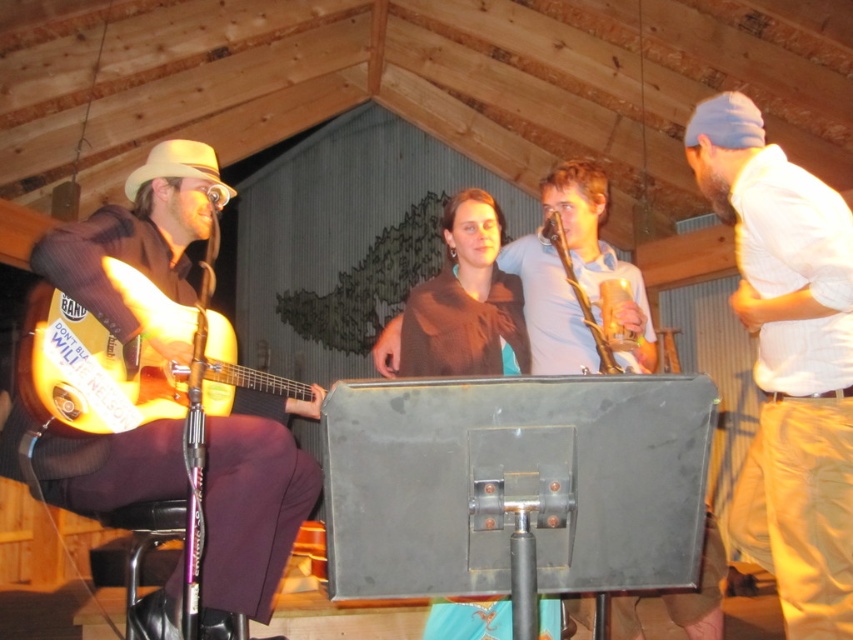
From the picture: You are a photographer at the event and need to capture a photo that includes both the white cotton shirt at right and the shiny orange electric guitar at left. Based on their positions, which object should be placed on the right side of the photo frame?

The white cotton shirt at right should be placed on the right side of the photo frame because it is already positioned to the right of the shiny orange electric guitar at left in the scene.

You are a photographer positioned at the camera. You want to capture a closeup shot of the white cotton shirt at right. Given that your camera can focus on subjects within 5 feet, will you be able to take the photo without moving closer?

The white cotton shirt at right is 6.67 feet away from the camera. Since your camera can focus within 5 feet, you need to move closer to capture the closeup shot.